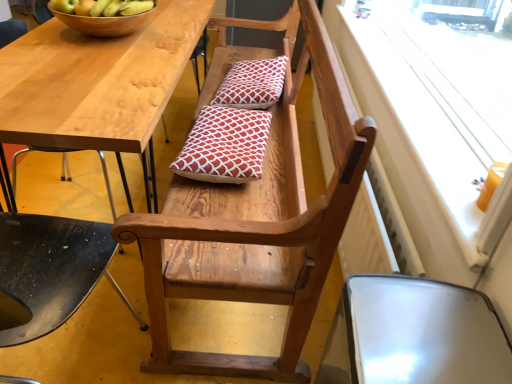
Question: Is red printed cushion at center, the 2th pillow when ordered from front to back, at the right side of wooden chair at lower center, which appears as the 3th chair when viewed from the right?

Choices:
 (A) no
 (B) yes

Answer: (B)

Question: Does red printed cushion at center, the 1th pillow viewed from the top, have a greater width compared to wooden chair at lower center, which appears as the 3th chair when viewed from the right?

Choices:
 (A) no
 (B) yes

Answer: (A)

Question: Does red printed cushion at center, the 2th pillow positioned from the bottom, come in front of wooden chair at lower center, the first chair from the left?

Choices:
 (A) yes
 (B) no

Answer: (B)

Question: From a real-world perspective, is red printed cushion at center, the 2th pillow when ordered from front to back, physically above wooden chair at lower center, the first chair from the left?

Choices:
 (A) no
 (B) yes

Answer: (B)

Question: Considering the relative sizes of red printed cushion at center, which is the first pillow from back to front, and wooden chair at lower center, the first chair from the left, in the image provided, is red printed cushion at center, which is the first pillow from back to front, taller than wooden chair at lower center, the first chair from the left,?

Choices:
 (A) yes
 (B) no

Answer: (B)

Question: From the image's perspective, is red printed cushion at center, the 1th pillow viewed from the top, below wooden chair at lower center, the first chair from the left?

Choices:
 (A) yes
 (B) no

Answer: (B)

Question: Considering the relative sizes of metallic silver chair at lower right, which is counted as the 3th chair, starting from the left, and wooden chair at lower center, which appears as the 3th chair when viewed from the right, in the image provided, is metallic silver chair at lower right, which is counted as the 3th chair, starting from the left, thinner than wooden chair at lower center, which appears as the 3th chair when viewed from the right,?

Choices:
 (A) yes
 (B) no

Answer: (A)

Question: Is metallic silver chair at lower right, the first chair in the right-to-left sequence, further to camera compared to wooden chair at lower center, the first chair from the left?

Choices:
 (A) yes
 (B) no

Answer: (A)

Question: Is metallic silver chair at lower right, the first chair in the right-to-left sequence, smaller than wooden chair at lower center, which appears as the 3th chair when viewed from the right?

Choices:
 (A) no
 (B) yes

Answer: (B)

Question: Is metallic silver chair at lower right, the first chair in the right-to-left sequence, next to wooden chair at lower center, which appears as the 3th chair when viewed from the right?

Choices:
 (A) yes
 (B) no

Answer: (B)

Question: Is metallic silver chair at lower right, which is counted as the 3th chair, starting from the left, at the right side of wooden chair at lower center, the first chair from the left?

Choices:
 (A) yes
 (B) no

Answer: (A)

Question: Is metallic silver chair at lower right, the first chair in the right-to-left sequence, to the left of wooden chair at lower center, which appears as the 3th chair when viewed from the right, from the viewer's perspective?

Choices:
 (A) yes
 (B) no

Answer: (B)

Question: Is green matte apple at upper left, positioned as the second apple in left-to-right order, taller than wooden chair at center, the 2th chair positioned from the right?

Choices:
 (A) yes
 (B) no

Answer: (B)